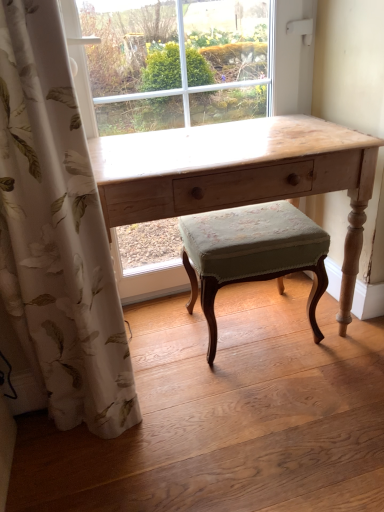
This screenshot has height=512, width=384. I want to click on white floral fabric curtain at left, so click(57, 232).

This screenshot has width=384, height=512. What do you see at coordinates (57, 232) in the screenshot? I see `white floral fabric curtain at left` at bounding box center [57, 232].

Measure the distance between point (197, 205) and camera.

Point (197, 205) is 3.82 feet away from camera.

Find the location of a particular element. The image size is (384, 512). green fabric stool at center is located at coordinates (252, 254).

Who is smaller, white floral fabric curtain at left or green fabric stool at center?

Smaller between the two is green fabric stool at center.

Which of these two, white floral fabric curtain at left or green fabric stool at center, is thinner?

white floral fabric curtain at left.

Measure the distance from white floral fabric curtain at left to green fabric stool at center.

white floral fabric curtain at left and green fabric stool at center are 19.45 inches apart from each other.

Can you tell me how much light wood desk at center and white floral fabric curtain at left differ in facing direction?

The angle between the facing direction of light wood desk at center and the facing direction of white floral fabric curtain at left is 1.22 degrees.

Between point (238, 196) and point (9, 71), which one is positioned in front?

The point (9, 71) is closer to the camera.

In terms of width, does light wood desk at center look wider or thinner when compared to white floral fabric curtain at left?

Clearly, light wood desk at center has more width compared to white floral fabric curtain at left.

From the image's perspective, is light wood desk at center under white floral fabric curtain at left?

Incorrect, from the image's perspective, light wood desk at center is higher than white floral fabric curtain at left.

Consider the image. From a real-world perspective, is light wood desk at center located beneath green fabric stool at center?

No, from a real-world perspective, light wood desk at center is not beneath green fabric stool at center.

Considering the positions of objects light wood desk at center and green fabric stool at center in the image provided, who is more to the right, light wood desk at center or green fabric stool at center?

From the viewer's perspective, green fabric stool at center appears more on the right side.

Is light wood desk at center directly adjacent to green fabric stool at center?

No, light wood desk at center is not with green fabric stool at center.

Can you confirm if green fabric stool at center is positioned to the right of white floral fabric curtain at left?

Indeed, green fabric stool at center is positioned on the right side of white floral fabric curtain at left.

From a real-world perspective, who is located higher, green fabric stool at center or white floral fabric curtain at left?

From a 3D spatial view, white floral fabric curtain at left is above.

Who is more distant, green fabric stool at center or white floral fabric curtain at left?

green fabric stool at center is further away from the camera.

Does point (291, 222) come closer to viewer compared to point (67, 407)?

No.

Can you confirm if green fabric stool at center is taller than light wood desk at center?

Incorrect, the height of green fabric stool at center is not larger of that of light wood desk at center.

Who is smaller, green fabric stool at center or light wood desk at center?

green fabric stool at center is smaller.

From the image's perspective, is green fabric stool at center under light wood desk at center?

Yes, from the image's perspective, green fabric stool at center is beneath light wood desk at center.

Locate an element on the screen. The width and height of the screenshot is (384, 512). desk that appears on the right of white floral fabric curtain at left is located at coordinates (238, 174).

Is white floral fabric curtain at left oriented away from light wood desk at center?

No, white floral fabric curtain at left's orientation is not away from light wood desk at center.

How many degrees apart are the facing directions of white floral fabric curtain at left and light wood desk at center?

The facing directions of white floral fabric curtain at left and light wood desk at center are 1.22 degrees apart.

Considering the sizes of white floral fabric curtain at left and light wood desk at center in the image, is white floral fabric curtain at left wider or thinner than light wood desk at center?

In the image, white floral fabric curtain at left appears to be more narrow than light wood desk at center.

Find the location of a particular element. The height and width of the screenshot is (512, 384). stool on the right of white floral fabric curtain at left is located at coordinates (252, 254).

You are a GUI agent. You are given a task and a screenshot of the screen. Output one action in this format:
    pyautogui.click(x=<x>, y=<y>)
    Task: Click on the curtain in front of the light wood desk at center
    This screenshot has width=384, height=512.
    Given the screenshot: What is the action you would take?
    pyautogui.click(x=57, y=232)

Which object lies further to the anchor point green fabric stool at center, white floral fabric curtain at left or light wood desk at center?

white floral fabric curtain at left is positioned further to the anchor green fabric stool at center.

Estimate the real-world distances between objects in this image. Which object is further from white floral fabric curtain at left, light wood desk at center or green fabric stool at center?

Among the two, green fabric stool at center is located further to white floral fabric curtain at left.

From the image, which object appears to be nearer to white floral fabric curtain at left, green fabric stool at center or light wood desk at center?

The object closer to white floral fabric curtain at left is light wood desk at center.

From the image, which object appears to be nearer to light wood desk at center, green fabric stool at center or white floral fabric curtain at left?

green fabric stool at center is positioned closer to the anchor light wood desk at center.

Estimate the real-world distances between objects in this image. Which object is further from green fabric stool at center, light wood desk at center or white floral fabric curtain at left?

The object further to green fabric stool at center is white floral fabric curtain at left.

Based on their spatial positions, is white floral fabric curtain at left or green fabric stool at center further from light wood desk at center?

white floral fabric curtain at left.

You are a GUI agent. You are given a task and a screenshot of the screen. Output one action in this format:
    pyautogui.click(x=<x>, y=<y>)
    Task: Click on the desk between white floral fabric curtain at left and green fabric stool at center in the horizontal direction
    
    Given the screenshot: What is the action you would take?
    pyautogui.click(x=238, y=174)